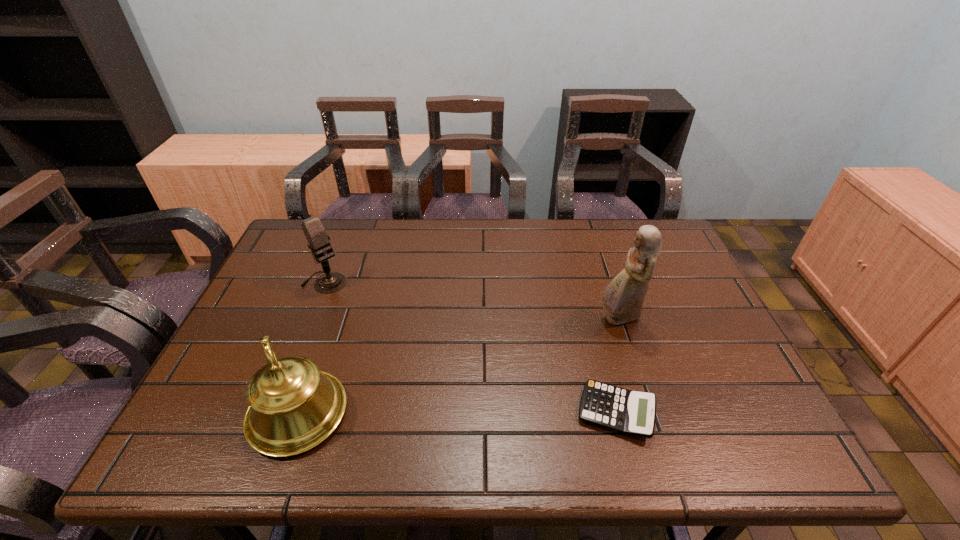
At what (x,y) coordinates should I click in order to perform the action: click on bell. Please return your answer as a coordinate pair (x, y). Looking at the image, I should click on pos(293,406).

Identify the location of the shortest object. (629, 412).

At what (x,y) coordinates should I click in order to perform the action: click on the second farthest object. Please return your answer as a coordinate pair (x, y). This screenshot has height=540, width=960. Looking at the image, I should click on (623, 298).

Identify the location of figurine. The width and height of the screenshot is (960, 540). (623, 298).

At what (x,y) coordinates should I click in order to perform the action: click on the farthest object. Please return your answer as a coordinate pair (x, y). This screenshot has height=540, width=960. Looking at the image, I should click on (315, 233).

The height and width of the screenshot is (540, 960). I want to click on free region located 0.390m on the right of the bell, so point(524,413).

You are a GUI agent. You are given a task and a screenshot of the screen. Output one action in this format:
    pyautogui.click(x=<x>, y=<y>)
    Task: Click on the free space located on the left of the calculator
    
    Given the screenshot: What is the action you would take?
    pyautogui.click(x=554, y=412)

Where is `free space located on the front-facing side of the third nearest object`? free space located on the front-facing side of the third nearest object is located at coordinates (558, 366).

Find the location of `vacant area situated on the front-facing side of the third nearest object`. vacant area situated on the front-facing side of the third nearest object is located at coordinates (550, 373).

At what (x,y) coordinates should I click in order to perform the action: click on vacant space located 0.360m on the front-facing side of the third nearest object. Please return your answer as a coordinate pair (x, y). Looking at the image, I should click on (508, 407).